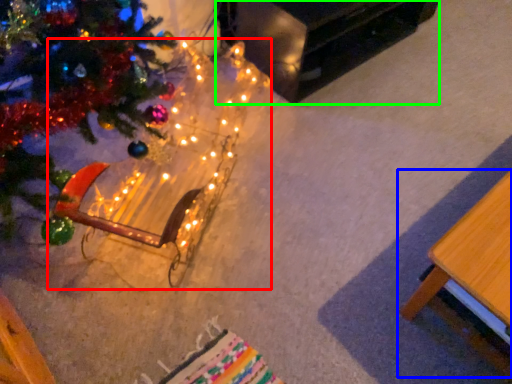
Question: Estimate the real-world distances between objects in this image. Which object is farther from christmas decoration (highlighted by a red box), table (highlighted by a blue box) or table (highlighted by a green box)?

Choices:
 (A) table
 (B) table

Answer: (A)